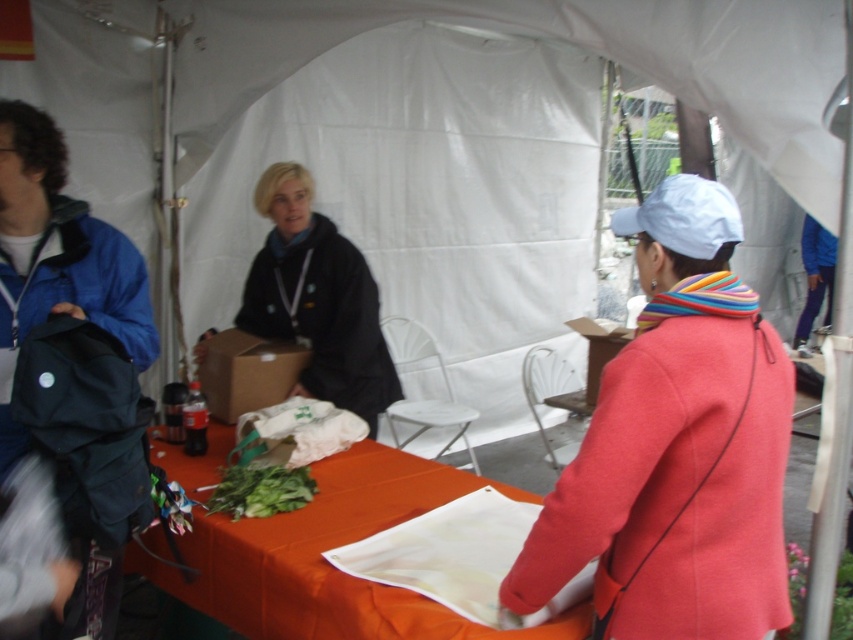
Question: Which of the following is the closest to the observer?

Choices:
 (A) white matte cloth at center
 (B) cardboard box at center
 (C) orange fabric table at center

Answer: (C)

Question: Which object is closer to the camera taking this photo?

Choices:
 (A) matte coral coat at right
 (B) orange fabric table at center
 (C) white matte cloth at center
 (D) green leafy vegetable at center

Answer: (A)

Question: Is the position of brown cardboard box at center less distant than that of green leafy vegetable at center?

Choices:
 (A) no
 (B) yes

Answer: (A)

Question: Which point is farther to the camera?

Choices:
 (A) (437, 524)
 (B) (263, 493)
 (C) (622, 328)
 (D) (265, 346)

Answer: (C)

Question: Is matte coral coat at right behind orange fabric table at center?

Choices:
 (A) no
 (B) yes

Answer: (A)

Question: Is orange fabric table at center behind brown cardboard box at center?

Choices:
 (A) yes
 (B) no

Answer: (B)